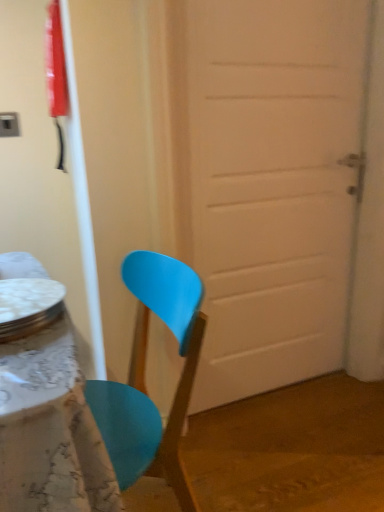
Find the location of a particular element. The height and width of the screenshot is (512, 384). vacant region in front of white matte door at center is located at coordinates (286, 452).